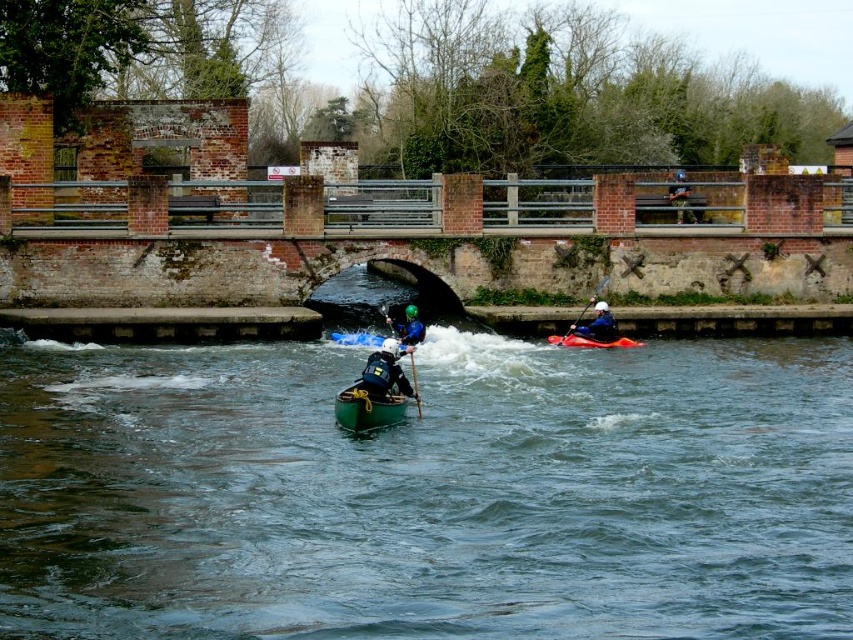
Is green matte canoe at center below orange plastic paddle at right?

Indeed, green matte canoe at center is positioned under orange plastic paddle at right.

Which is above, green matte canoe at center or orange plastic paddle at right?

Positioned higher is orange plastic paddle at right.

Locate an element on the screen. The height and width of the screenshot is (640, 853). green matte canoe at center is located at coordinates (368, 406).

Identify the location of green matte canoe at center. pyautogui.click(x=368, y=406).

Does point (685, 182) lie in front of point (640, 346)?

No, (685, 182) is behind (640, 346).

Which is behind, point (688, 212) or point (634, 344)?

Point (688, 212)

The width and height of the screenshot is (853, 640). In order to click on blue fabric jacket at upper center in this screenshot , I will do `click(680, 196)`.

Who is positioned more to the left, green rubber boat at center or green helmeted kayaker at center?

green rubber boat at center

The width and height of the screenshot is (853, 640). In order to click on green rubber boat at center in this screenshot , I will do `click(427, 492)`.

Find the location of a particular element. This screenshot has height=640, width=853. green rubber boat at center is located at coordinates (427, 492).